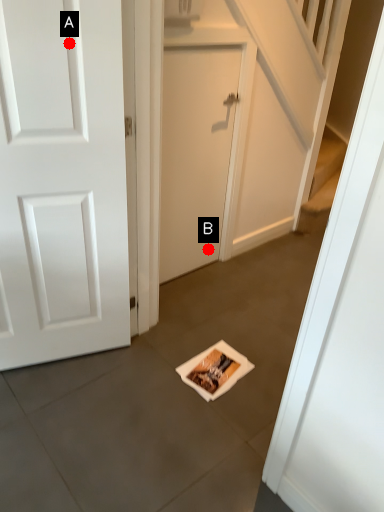
Question: Two points are circled on the image, labeled by A and B beside each circle. Which point is closer to the camera taking this photo?

Choices:
 (A) A is closer
 (B) B is closer

Answer: (A)